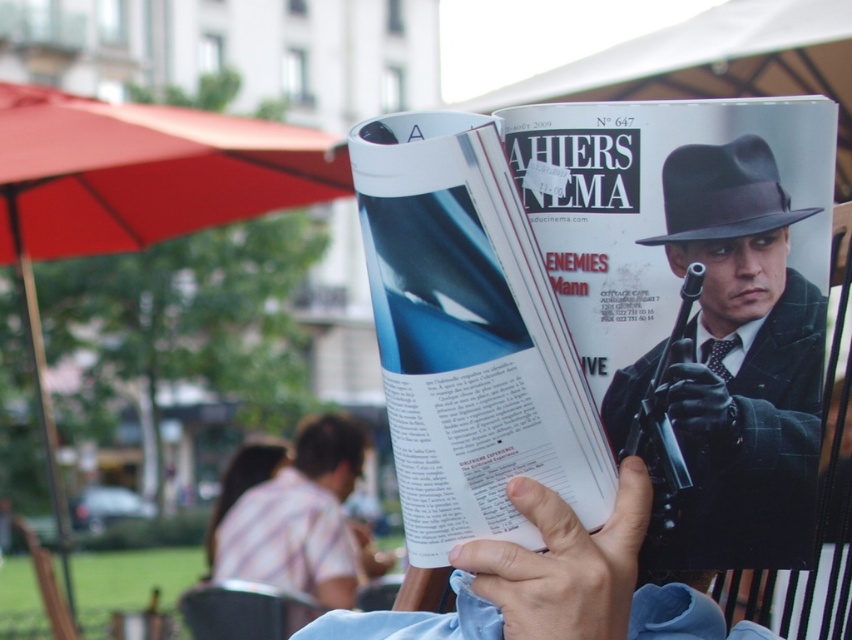
Question: Which object is positioned closest to the red fabric umbrella at upper left?

Choices:
 (A) matte black hat at right
 (B) blurred hair at center
 (C) white glossy magazine at center
 (D) striped shirt at center

Answer: (D)

Question: Which point is farther to the camera?

Choices:
 (A) (314, 452)
 (B) (373, 252)
 (C) (325, 486)
 (D) (775, 244)

Answer: (C)

Question: Can you confirm if black felt fedora at upper right is smaller than blurred hair at center?

Choices:
 (A) yes
 (B) no

Answer: (A)

Question: Does matte black hat at right appear under blurred hair at center?

Choices:
 (A) no
 (B) yes

Answer: (A)

Question: Estimate the real-world distances between objects in this image. Which object is farther from the black felt fedora at upper right?

Choices:
 (A) red fabric umbrella at upper left
 (B) blurred hair at center
 (C) white glossy magazine at center

Answer: (B)

Question: Is matte black hat at right to the right of black felt fedora at upper right from the viewer's perspective?

Choices:
 (A) yes
 (B) no

Answer: (B)